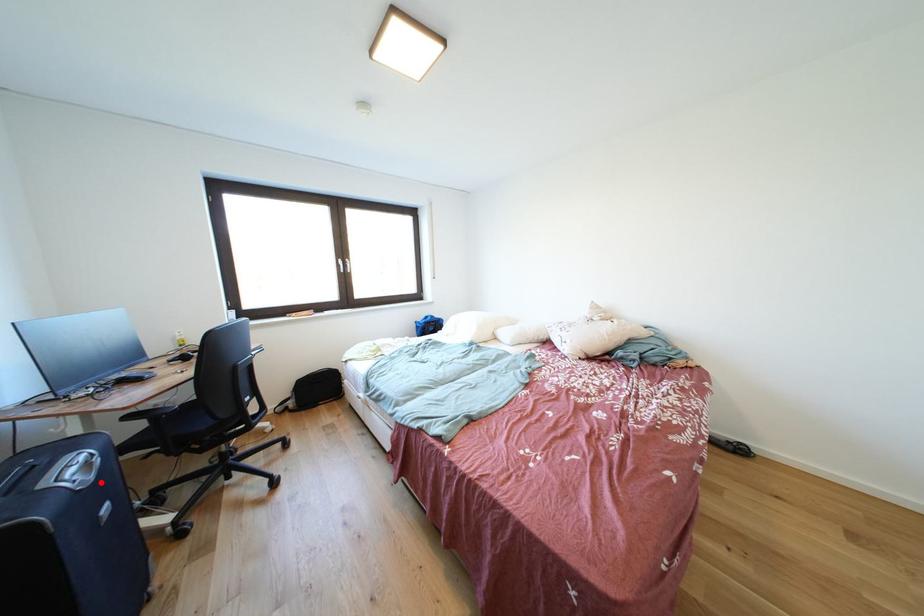
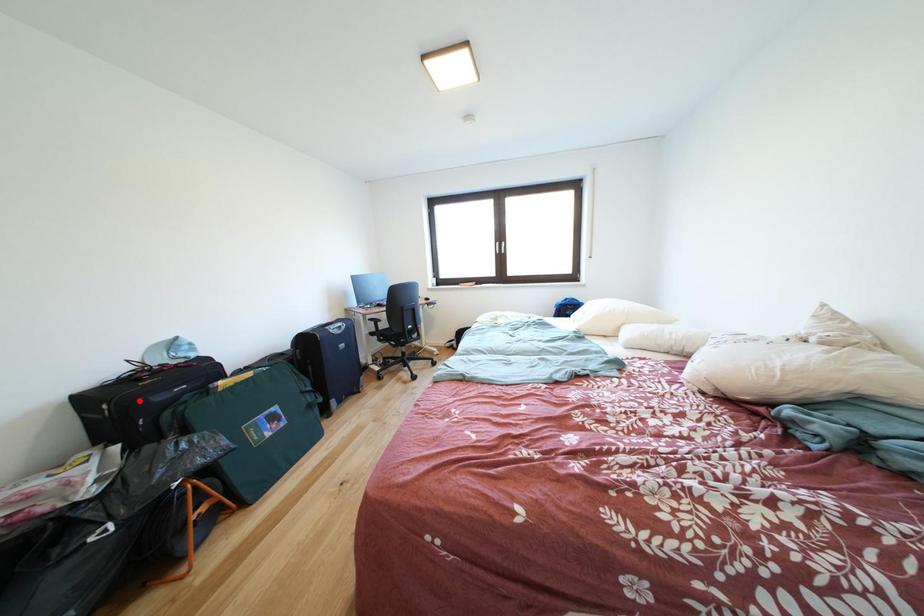
I am providing you with two images of the same scene from different viewpoints. A red point is marked on the first image and another point is marked on the second image. Do the highlighted points in image1 and image2 indicate the same real-world spot?

No